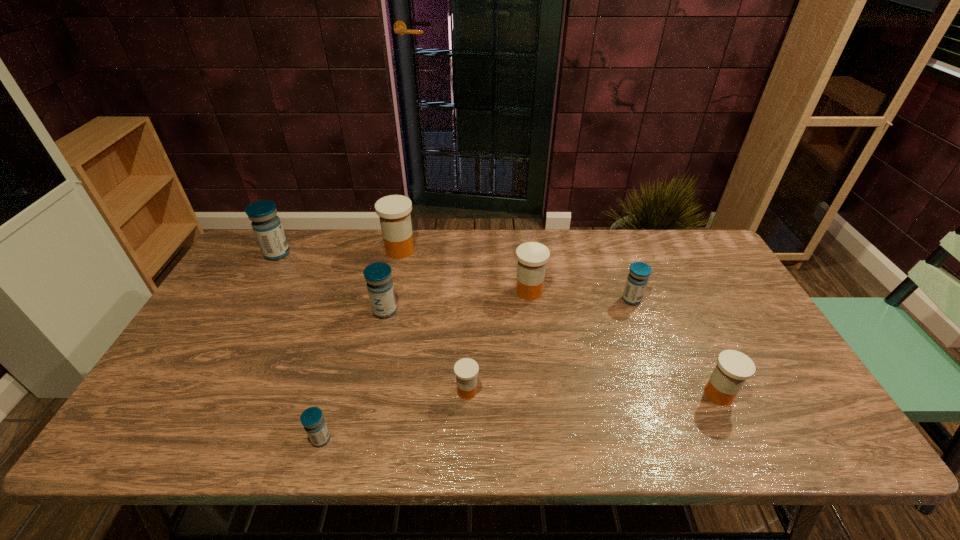
At what (x,y) coordinates should I click in order to perform the action: click on the biggest blue medicine. Please return your answer as a coordinate pair (x, y). The height and width of the screenshot is (540, 960). Looking at the image, I should click on (266, 225).

Identify the location of the farthest blue medicine. (266, 225).

At what (x,y) coordinates should I click in order to perform the action: click on the farthest orange medicine. Please return your answer as a coordinate pair (x, y). This screenshot has height=540, width=960. Looking at the image, I should click on [x=394, y=211].

I want to click on the leftmost orange medicine, so click(x=394, y=211).

Image resolution: width=960 pixels, height=540 pixels. In order to click on the second farthest orange medicine in this screenshot , I will do `click(532, 257)`.

Identify the location of the third object from right to left. Image resolution: width=960 pixels, height=540 pixels. (532, 257).

The height and width of the screenshot is (540, 960). In order to click on the third blue medicine from left to right in this screenshot , I will do `click(378, 275)`.

This screenshot has width=960, height=540. Find the location of `the rightmost blue medicine`. the rightmost blue medicine is located at coordinates pyautogui.click(x=639, y=272).

The height and width of the screenshot is (540, 960). Find the location of `the seventh object from left to right`. the seventh object from left to right is located at coordinates (639, 272).

Identify the location of the rightmost medicine. This screenshot has height=540, width=960. [x=733, y=368].